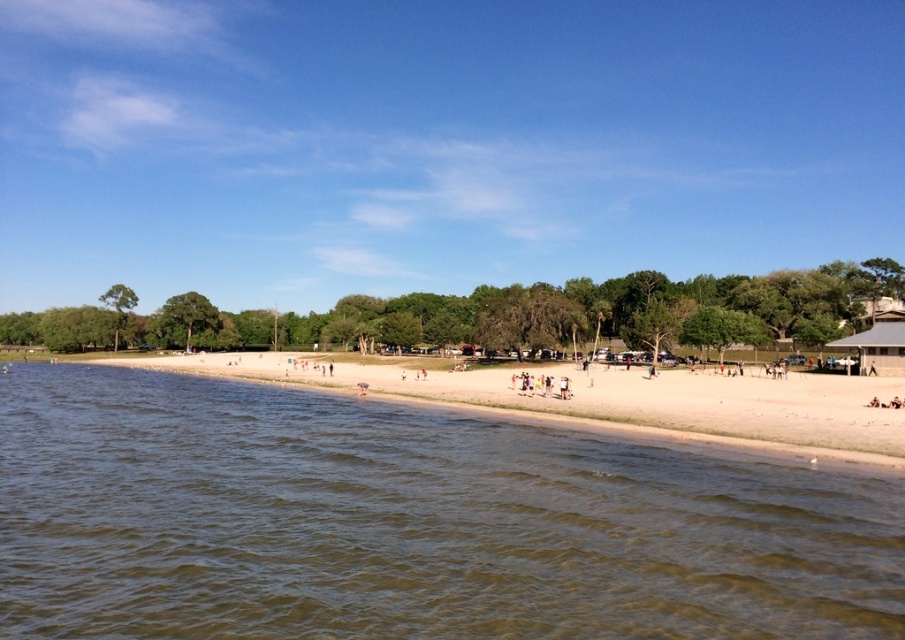
Question: Which object is closer to the camera taking this photo?

Choices:
 (A) brown water at lower left
 (B) light brown sand at center

Answer: (A)

Question: Does brown water at lower left have a larger size compared to light brown sand at center?

Choices:
 (A) no
 (B) yes

Answer: (A)

Question: Can you confirm if brown water at lower left is smaller than light brown sand at center?

Choices:
 (A) yes
 (B) no

Answer: (A)

Question: Which object appears farthest from the camera in this image?

Choices:
 (A) brown water at lower left
 (B) light brown sand at center

Answer: (B)

Question: Which point appears farthest from the camera in this image?

Choices:
 (A) (75, 557)
 (B) (754, 420)

Answer: (B)

Question: Is brown water at lower left to the right of light brown sand at center from the viewer's perspective?

Choices:
 (A) no
 (B) yes

Answer: (B)